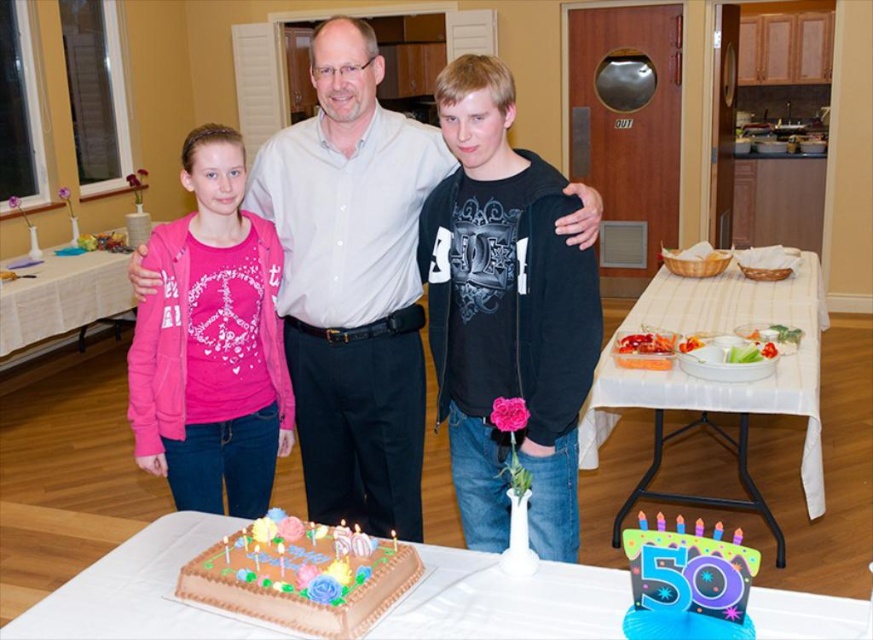
You are a guest at the celebration and need to place a rectangular cake on either the black matte hoodie at center or the white plastic table at center. Which surface is more suitable for placing the cake?

The white plastic table at center is more suitable for placing the cake because it is thicker than the black matte hoodie at center, providing a stable and flat surface.

You are a guest at the celebration and want to sit down at the white plastic table at center. Which side of the table should you approach to avoid the black matte hoodie at center?

You should approach the right side of the white plastic table at center since the black matte hoodie at center is on the left side of the table.